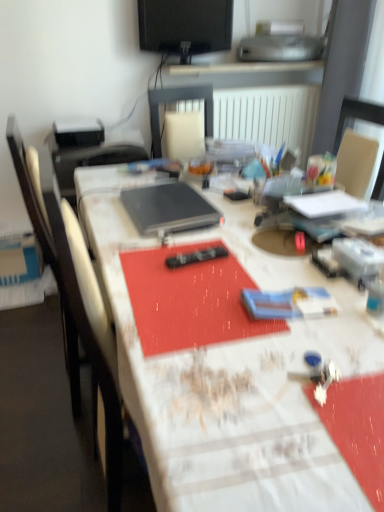
You are a GUI agent. You are given a task and a screenshot of the screen. Output one action in this format:
    pyautogui.click(x=<x>, y=<y>)
    Task: Click on the vacant area on top of black matte laptop at center (from a real-world perspective)
    This screenshot has width=384, height=512.
    Given the screenshot: What is the action you would take?
    pyautogui.click(x=166, y=202)